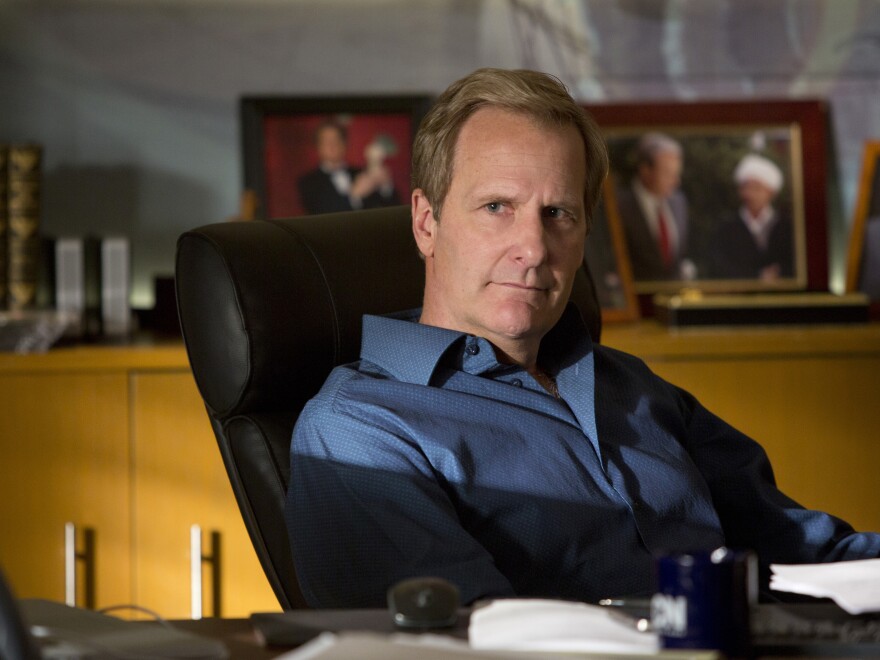
Locate an element on the screen. handle is located at coordinates (72, 571).